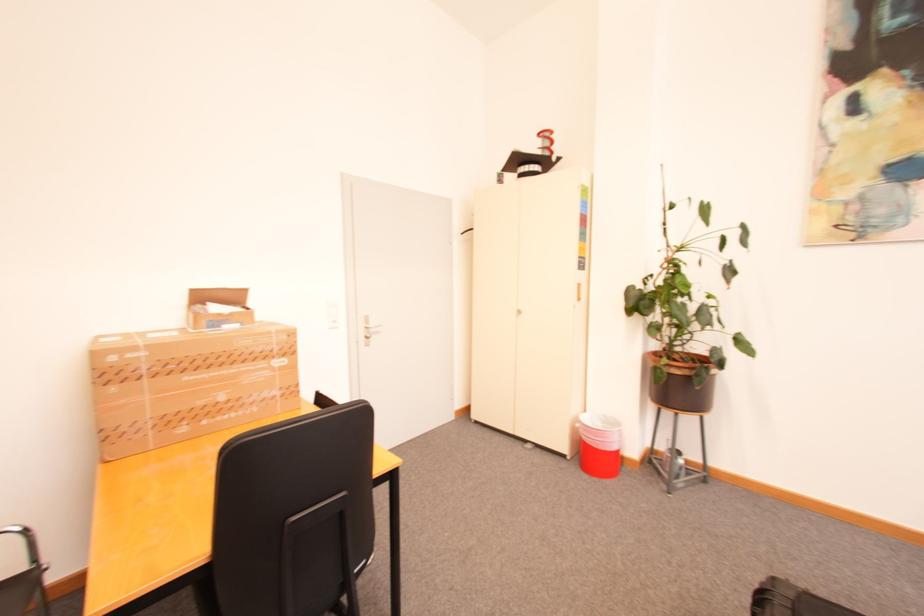
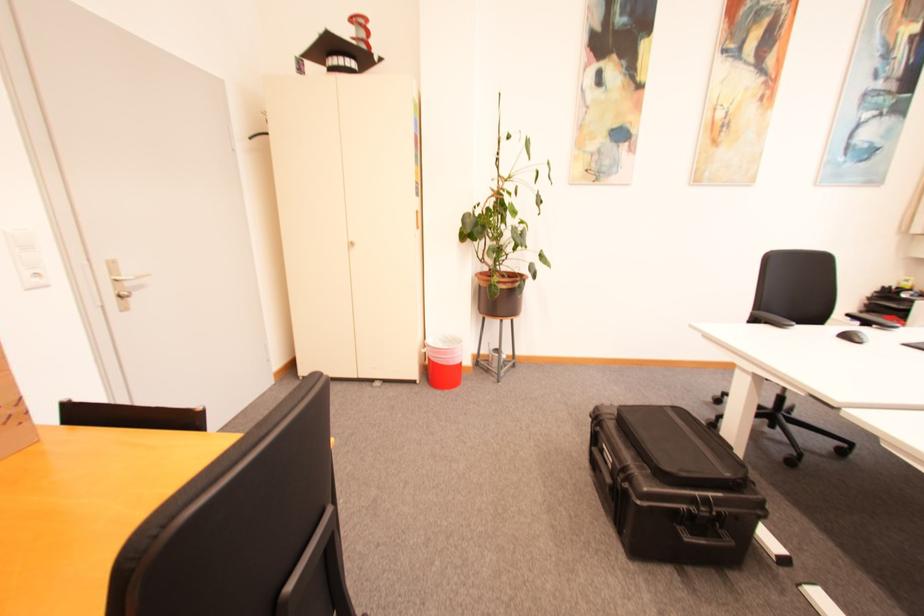
The point at (584,426) is marked in the first image. Where is the corresponding point in the second image?

(431, 351)